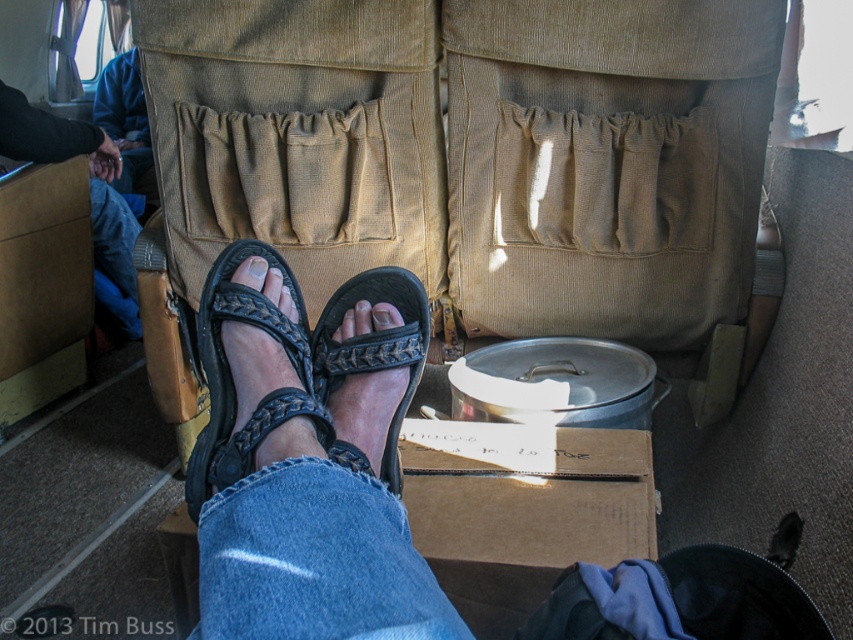
You are a passenger in a vehicle and need to place a small bag on the floor. The brown cardboard box at center is in the way. Where should you move the box to make space?

The brown cardboard box at center is located at point (524, 509). To make space, you could move it to an adjacent area like under the seat or towards the front or back of the vehicle where there is more room.